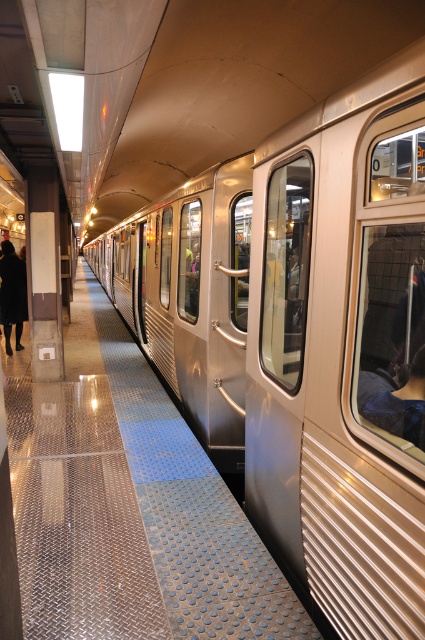
Which is behind, point (391, 406) or point (22, 260)?

Point (22, 260)

Between dark blue fabric at train right and dark brown leather coat at left, which one has less height?

With less height is dark blue fabric at train right.

What are the coordinates of `dark blue fabric at train right` in the screenshot? It's located at (402, 404).